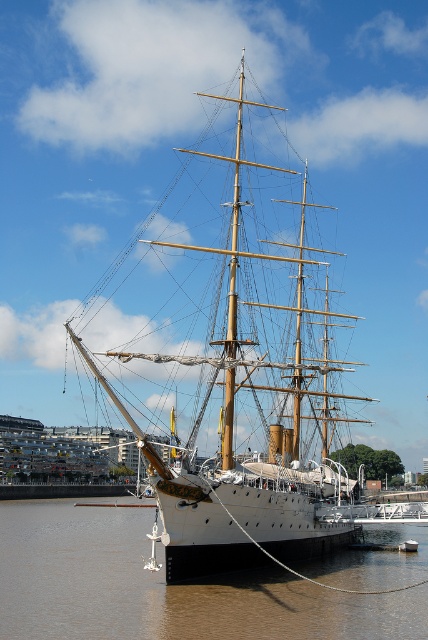
Question: Is white polished wood sailboat at center bigger than brown/muddy water at lower center?

Choices:
 (A) yes
 (B) no

Answer: (A)

Question: Does white polished wood sailboat at center lie in front of brown/muddy water at lower center?

Choices:
 (A) yes
 (B) no

Answer: (A)

Question: Observing the image, what is the correct spatial positioning of white polished wood sailboat at center in reference to brown/muddy water at lower center?

Choices:
 (A) right
 (B) left

Answer: (A)

Question: Which point is closer to the camera taking this photo?

Choices:
 (A) (294, 397)
 (B) (261, 612)

Answer: (B)